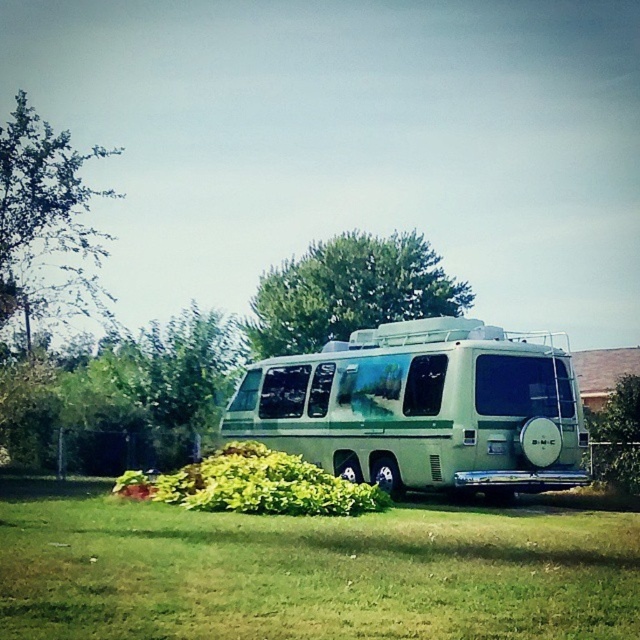
You are standing in front of the vintage RV parked on the grassy lawn. You want to place a small potted plant exactly at the point marked as point (310, 573). If the potted plant is 1.2 meters tall, will it be visible from your current position?

The point (310, 573) is 7.34 meters away from the camera. Since the potted plant is 1.2 meters tall, it will likely be visible from your current position as the distance is not too far and there are no obstructions mentioned in the scene description.

You are planning to set up a picnic blanket in the green grass at center. Considering the space occupied by the green matte van at center, will there be enough room to spread out the blanket without it overlapping the van?

The green grass at center might be wider than the green matte van at center, so there could be enough space to spread out the picnic blanket without overlapping the van. However, the exact width isn not specified, so it depends on how much wider the grass area is compared to the van.

You are standing in the middle of the green grass at center and want to walk towards the green leafy tree at upper left. Which direction should you head to reach the tree?

Since the green grass at center has a lesser width compared to the green leafy tree at upper left, you should head towards the upper left direction to reach the tree.